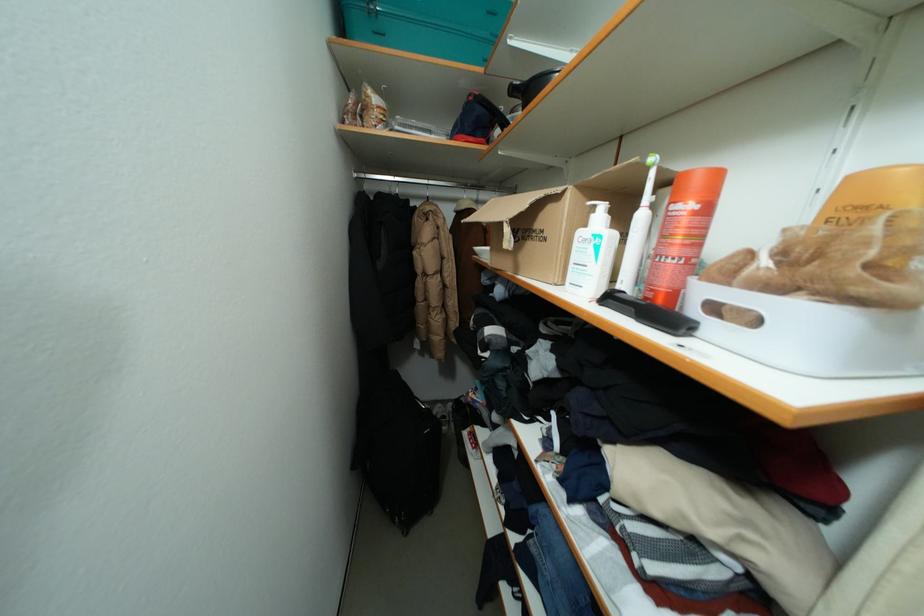
This screenshot has width=924, height=616. Identify the location of turquoise box latch. (371, 7).